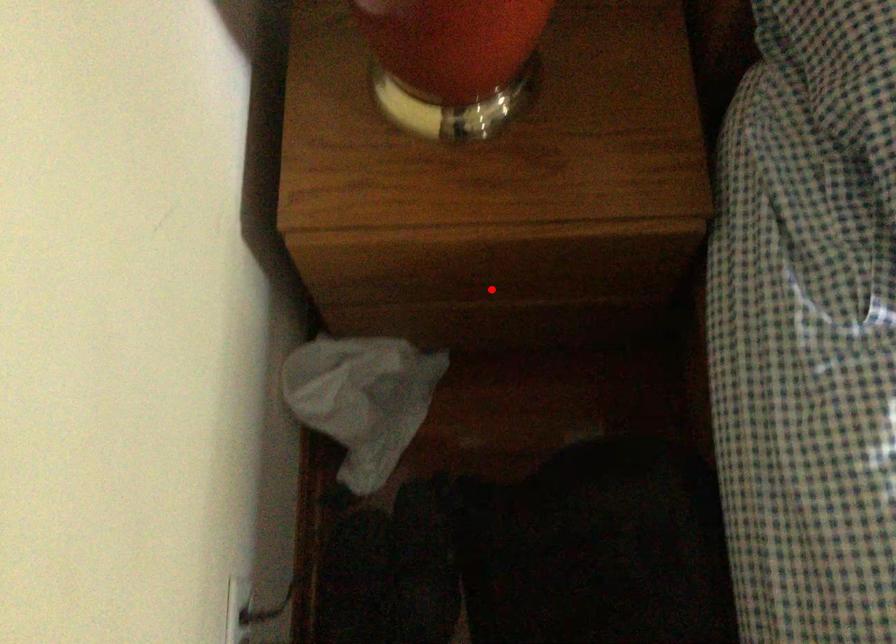
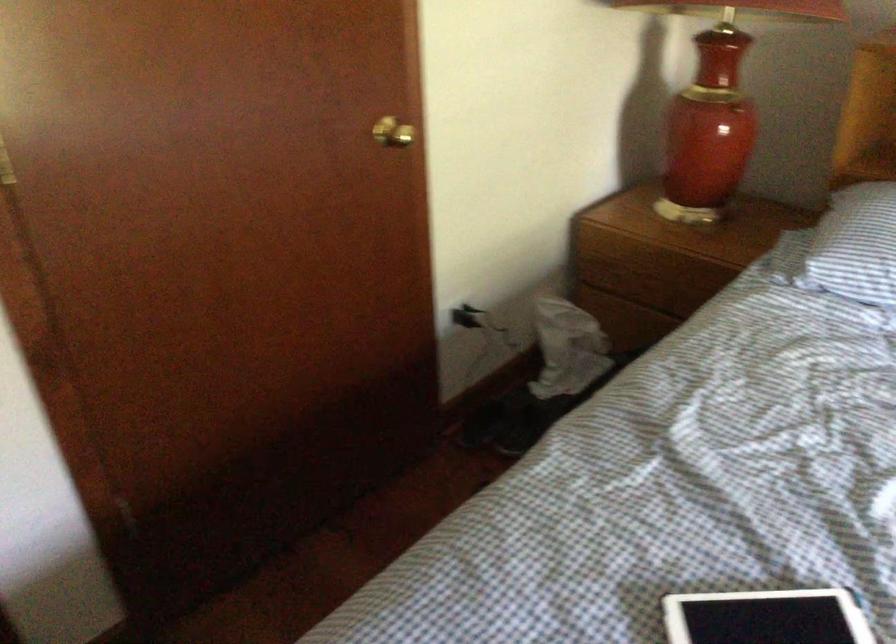
Question: I am providing you with two images of the same scene from different viewpoints. Given a red point in image1, look at the same physical point in image2. Is it:

Choices:
 (A) Closer to the viewpoint
 (B) Farther from the viewpoint

Answer: (B)